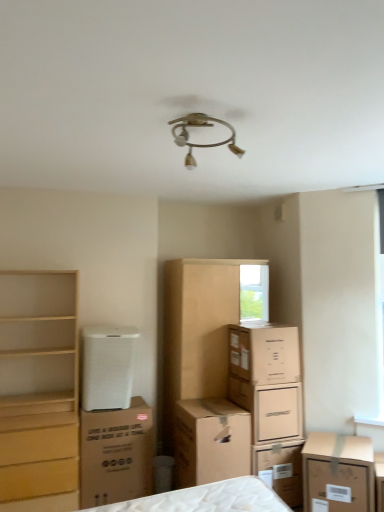
Describe the element at coordinates (264, 353) in the screenshot. I see `brown cardboard box at center, the 3th cardboard box positioned from the right` at that location.

This screenshot has height=512, width=384. I want to click on brown cardboard box at lower right, which is the first cardboard box from right to left, so click(x=338, y=473).

Measure the distance between brown cardboard box at lower right, which appears as the fifth cardboard box when viewed from the left, and camera.

brown cardboard box at lower right, which appears as the fifth cardboard box when viewed from the left, and camera are 2.84 meters apart from each other.

Locate an element on the screen. brown cardboard box at lower left, which is the 1th cardboard box in left-to-right order is located at coordinates (116, 454).

The image size is (384, 512). What do you see at coordinates (269, 408) in the screenshot?
I see `white cardboard box at center, placed as the fourth cardboard box when sorted from left to right` at bounding box center [269, 408].

Describe the element at coordinates (210, 441) in the screenshot. The height and width of the screenshot is (512, 384). I see `brown cardboard box at center, which is the second cardboard box from left to right` at that location.

You are a GUI agent. You are given a task and a screenshot of the screen. Output one action in this format:
    pyautogui.click(x=<x>, y=<y>)
    Task: Click on the white mesh air purifier at lower left
    The image size is (384, 512).
    Given the screenshot: What is the action you would take?
    pyautogui.click(x=108, y=367)

Locate an element on the screen. brown cardboard dresser at center is located at coordinates (197, 331).

Looking at this image, can you confirm if white cardboard box at center, placed as the fourth cardboard box when sorted from left to right, is shorter than brown cardboard box at lower left, which is the 1th cardboard box in left-to-right order?

Yes, white cardboard box at center, placed as the fourth cardboard box when sorted from left to right, is shorter than brown cardboard box at lower left, which is the 1th cardboard box in left-to-right order.

From the picture: Is white cardboard box at center, placed as the fourth cardboard box when sorted from left to right, in contact with brown cardboard box at lower left, which is the 1th cardboard box in left-to-right order?

No, white cardboard box at center, placed as the fourth cardboard box when sorted from left to right, is not beside brown cardboard box at lower left, which is the 1th cardboard box in left-to-right order.

Which of these two, white cardboard box at center, placed as the fourth cardboard box when sorted from left to right, or brown cardboard box at lower left, which is the 1th cardboard box in left-to-right order, is thinner?

white cardboard box at center, placed as the fourth cardboard box when sorted from left to right, is thinner.

Between point (275, 397) and point (145, 438), which one is positioned behind?

The point (275, 397) is more distant.

Considering the relative sizes of brown cardboard box at center, which is the second cardboard box from left to right, and brown cardboard box at lower right, which is the first cardboard box from right to left, in the image provided, is brown cardboard box at center, which is the second cardboard box from left to right, wider than brown cardboard box at lower right, which is the first cardboard box from right to left,?

Yes.

Could you tell me if brown cardboard box at center, which is the second cardboard box from left to right, is facing brown cardboard box at lower right, which is the first cardboard box from right to left?

No, brown cardboard box at center, which is the second cardboard box from left to right, is not turned towards brown cardboard box at lower right, which is the first cardboard box from right to left.

Is brown cardboard box at center, positioned as the 4th cardboard box in right-to-left order, positioned in front of brown cardboard box at lower right, which appears as the fifth cardboard box when viewed from the left?

No, brown cardboard box at center, positioned as the 4th cardboard box in right-to-left order, is behind brown cardboard box at lower right, which appears as the fifth cardboard box when viewed from the left.

Is brown cardboard box at center, which is the second cardboard box from left to right, completely or partially outside of brown cardboard box at lower right, which appears as the fifth cardboard box when viewed from the left?

Yes.

Is brown cardboard box at center, which is the second cardboard box from left to right, bigger than white cardboard box at center, which ranks as the second cardboard box in right-to-left order?

Correct, brown cardboard box at center, which is the second cardboard box from left to right, is larger in size than white cardboard box at center, which ranks as the second cardboard box in right-to-left order.

How many degrees apart are the facing directions of brown cardboard box at center, which is the second cardboard box from left to right, and white cardboard box at center, which ranks as the second cardboard box in right-to-left order?

1.51 degrees separate the facing orientations of brown cardboard box at center, which is the second cardboard box from left to right, and white cardboard box at center, which ranks as the second cardboard box in right-to-left order.

From a real-world perspective, is brown cardboard box at center, which is the second cardboard box from left to right, physically below white cardboard box at center, which ranks as the second cardboard box in right-to-left order?

Correct, in the physical world, brown cardboard box at center, which is the second cardboard box from left to right, is lower than white cardboard box at center, which ranks as the second cardboard box in right-to-left order.

Is brown cardboard box at center, positioned as the 4th cardboard box in right-to-left order, turned away from white cardboard box at center, which ranks as the second cardboard box in right-to-left order?

No, brown cardboard box at center, positioned as the 4th cardboard box in right-to-left order, is not facing the opposite direction of white cardboard box at center, which ranks as the second cardboard box in right-to-left order.

From a real-world perspective, which is physically above, brown cardboard box at lower left, the fifth cardboard box positioned from the right, or white cardboard box at center, placed as the fourth cardboard box when sorted from left to right?

white cardboard box at center, placed as the fourth cardboard box when sorted from left to right.

Which point is more forward, (139, 416) or (263, 399)?

The point (139, 416) is more forward.

Do you think brown cardboard box at lower left, which is the 1th cardboard box in left-to-right order, is within white cardboard box at center, placed as the fourth cardboard box when sorted from left to right, or outside of it?

brown cardboard box at lower left, which is the 1th cardboard box in left-to-right order, is not enclosed by white cardboard box at center, placed as the fourth cardboard box when sorted from left to right.

From the picture: Could you tell me if brown cardboard box at lower left, which is the 1th cardboard box in left-to-right order, is facing white cardboard box at center, placed as the fourth cardboard box when sorted from left to right?

No, brown cardboard box at lower left, which is the 1th cardboard box in left-to-right order, does not turn towards white cardboard box at center, placed as the fourth cardboard box when sorted from left to right.

Does point (181, 391) come in front of point (36, 405)?

No.

Consider the image. Can light wood chest of drawers at left be found inside brown cardboard dresser at center?

No, light wood chest of drawers at left is not inside brown cardboard dresser at center.

Considering the positions of objects brown cardboard dresser at center and light wood chest of drawers at left in the image provided, who is behind, brown cardboard dresser at center or light wood chest of drawers at left?

brown cardboard dresser at center is behind.

From the image's perspective, is brown cardboard dresser at center above or below light wood chest of drawers at left?

brown cardboard dresser at center is above light wood chest of drawers at left.

Considering the sizes of objects brown cardboard box at lower right, which appears as the fifth cardboard box when viewed from the left, and brown cardboard box at center, the 3th cardboard box positioned from the right, in the image provided, who is wider, brown cardboard box at lower right, which appears as the fifth cardboard box when viewed from the left, or brown cardboard box at center, the 3th cardboard box positioned from the right,?

Wider between the two is brown cardboard box at lower right, which appears as the fifth cardboard box when viewed from the left.

Looking at this image, who is shorter, brown cardboard box at lower right, which is the first cardboard box from right to left, or brown cardboard box at center, the 3th cardboard box positioned from the right?

With less height is brown cardboard box at center, the 3th cardboard box positioned from the right.

Is brown cardboard box at lower right, which is the first cardboard box from right to left, to the left or to the right of brown cardboard box at center, which is the third cardboard box in left-to-right order, in the image?

Clearly, brown cardboard box at lower right, which is the first cardboard box from right to left, is on the right of brown cardboard box at center, which is the third cardboard box in left-to-right order, in the image.

From the picture: Does brown cardboard box at lower right, which is the first cardboard box from right to left, turn towards brown cardboard box at center, which is the third cardboard box in left-to-right order?

No, brown cardboard box at lower right, which is the first cardboard box from right to left, is not turned towards brown cardboard box at center, which is the third cardboard box in left-to-right order.

Does brown cardboard dresser at center contain brown cardboard box at center, positioned as the 4th cardboard box in right-to-left order?

Actually, brown cardboard box at center, positioned as the 4th cardboard box in right-to-left order, is outside brown cardboard dresser at center.

Considering the positions of points (236, 266) and (188, 462), is point (236, 266) farther from camera compared to point (188, 462)?

Yes, point (236, 266) is farther from viewer.

In terms of height, does brown cardboard dresser at center look taller or shorter compared to brown cardboard box at center, which is the second cardboard box from left to right?

Clearly, brown cardboard dresser at center is taller compared to brown cardboard box at center, which is the second cardboard box from left to right.

In order to click on cardboard box that is the 2nd one when counting upward from the brown cardboard box at lower left, which is the 1th cardboard box in left-to-right order (from the image's perspective) in this screenshot , I will do `click(269, 408)`.

This screenshot has height=512, width=384. I want to click on the 1st cardboard box behind the brown cardboard box at lower right, which appears as the fifth cardboard box when viewed from the left, counting from the anchor's position, so click(210, 441).

When comparing their distances from brown cardboard box at center, the 3th cardboard box positioned from the right, does light wood chest of drawers at left or brown cardboard box at lower left, which is the 1th cardboard box in left-to-right order, seem further?

light wood chest of drawers at left.

Estimate the real-world distances between objects in this image. Which object is closer to white mesh air purifier at lower left, white cardboard box at center, placed as the fourth cardboard box when sorted from left to right, or brown cardboard dresser at center?

The object closer to white mesh air purifier at lower left is brown cardboard dresser at center.

Estimate the real-world distances between objects in this image. Which object is further from white mesh air purifier at lower left, brown cardboard box at lower right, which is the first cardboard box from right to left, or light wood chest of drawers at left?

brown cardboard box at lower right, which is the first cardboard box from right to left, is further to white mesh air purifier at lower left.

When comparing their distances from brown cardboard box at center, which is the third cardboard box in left-to-right order, does brown cardboard dresser at center or white cardboard box at center, which ranks as the second cardboard box in right-to-left order, seem further?

Among the two, brown cardboard dresser at center is located further to brown cardboard box at center, which is the third cardboard box in left-to-right order.

When comparing their distances from brown cardboard box at lower right, which is the first cardboard box from right to left, does white mesh air purifier at lower left or light wood chest of drawers at left seem closer?

Among the two, white mesh air purifier at lower left is located nearer to brown cardboard box at lower right, which is the first cardboard box from right to left.

When comparing their distances from brown cardboard box at center, which is the second cardboard box from left to right, does light wood chest of drawers at left or brown cardboard box at lower right, which is the first cardboard box from right to left, seem closer?

The object closer to brown cardboard box at center, which is the second cardboard box from left to right, is brown cardboard box at lower right, which is the first cardboard box from right to left.

Which object lies nearer to the anchor point white mesh air purifier at lower left, brown cardboard box at center, the 3th cardboard box positioned from the right, or white cardboard box at center, which ranks as the second cardboard box in right-to-left order?

brown cardboard box at center, the 3th cardboard box positioned from the right, lies closer to white mesh air purifier at lower left than the other object.

When comparing their distances from white mesh air purifier at lower left, does light wood chest of drawers at left or brown cardboard dresser at center seem further?

The object further to white mesh air purifier at lower left is brown cardboard dresser at center.

Find the location of `dresser situated between brown cardboard box at center, which is the second cardboard box from left to right, and brown cardboard box at lower right, which is the first cardboard box from right to left, from left to right`. dresser situated between brown cardboard box at center, which is the second cardboard box from left to right, and brown cardboard box at lower right, which is the first cardboard box from right to left, from left to right is located at coordinates (197, 331).

The image size is (384, 512). In order to click on dresser located between white mesh air purifier at lower left and white cardboard box at center, placed as the fourth cardboard box when sorted from left to right, in the left-right direction in this screenshot , I will do `click(197, 331)`.

The width and height of the screenshot is (384, 512). Find the location of `dresser situated between brown cardboard box at lower left, which is the 1th cardboard box in left-to-right order, and white cardboard box at center, which ranks as the second cardboard box in right-to-left order, from left to right`. dresser situated between brown cardboard box at lower left, which is the 1th cardboard box in left-to-right order, and white cardboard box at center, which ranks as the second cardboard box in right-to-left order, from left to right is located at coordinates (197, 331).

The height and width of the screenshot is (512, 384). In order to click on appliance positioned between metallic gold ceiling light at upper center and brown cardboard dresser at center from near to far in this screenshot , I will do `click(108, 367)`.